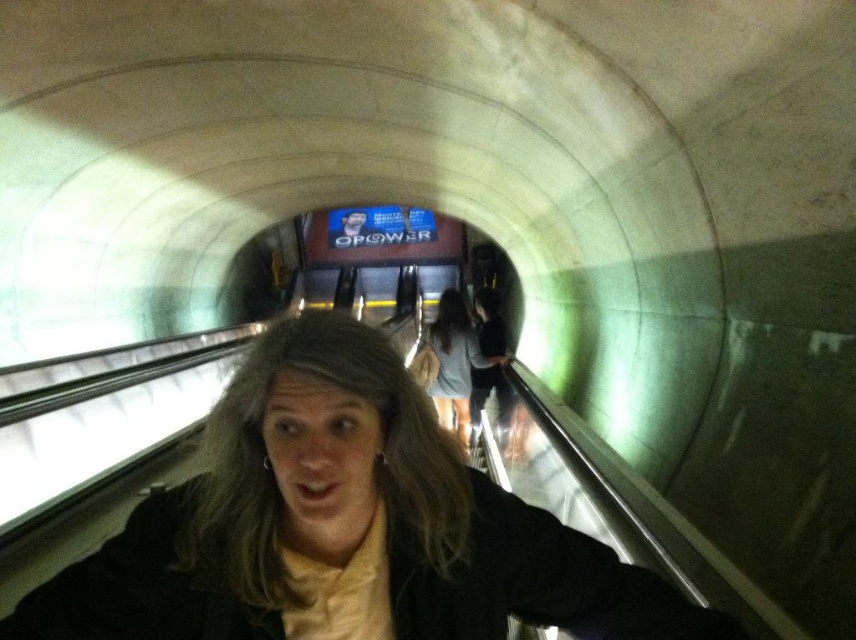
Question: Which point is farther to the camera?

Choices:
 (A) matte black jacket at center
 (B) light gray fabric skirt at center

Answer: (B)

Question: Does matte black jacket at center have a greater width compared to light gray fabric skirt at center?

Choices:
 (A) yes
 (B) no

Answer: (A)

Question: Is matte black jacket at center to the right of light gray fabric skirt at center from the viewer's perspective?

Choices:
 (A) no
 (B) yes

Answer: (A)

Question: Can you confirm if matte black jacket at center is bigger than light gray fabric skirt at center?

Choices:
 (A) no
 (B) yes

Answer: (A)